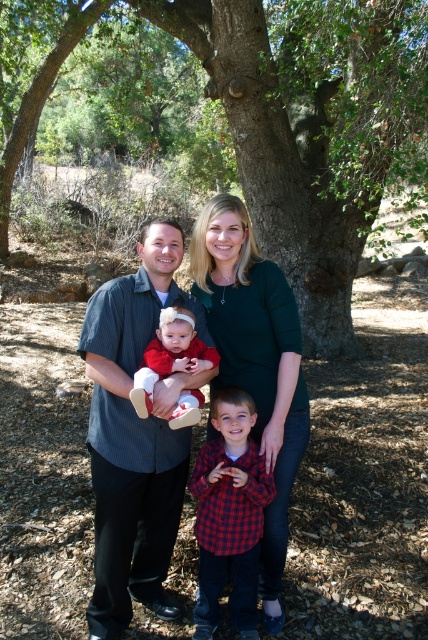
Based on the photo, you are a photographer trying to capture a closeup shot of the green matte shirt at center and the matte red dress at center. The camera you are using has a minimum focusing distance of 30 centimeters. Can you take a clear photo of both subjects without moving them?

The green matte shirt at center is 35.99 centimeters from the matte red dress at center. Since the camera requires a minimum focusing distance of 30 centimeters, the distance between them is sufficient for a clear photo without needing to move them.

You are a photographer trying to capture a group photo of the family. You need to ensure that the dark gray shirt at center and the matte red dress at center are within a 20 cm distance to frame them properly. Based on the scene description, can you confirm if they are close enough?

The distance between the dark gray shirt at center and the matte red dress at center is 18.34 centimeters, which is within the 20 cm requirement. Therefore, they are close enough to be framed properly.

You are standing at the origin point of the image. Where is the green leafy tree at center located in terms of coordinates?

The green leafy tree at center is located at coordinates point (312, 129).